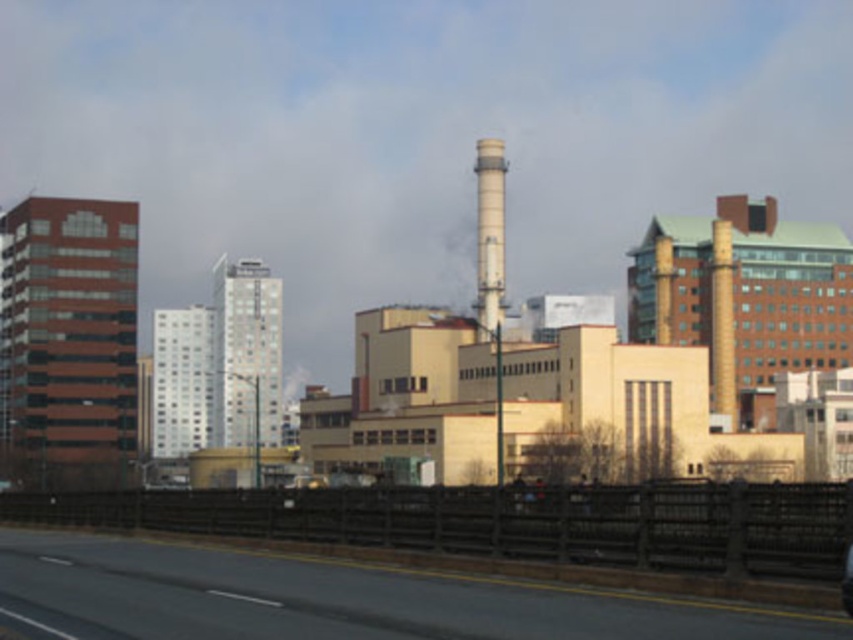
Can you confirm if black asphalt highway at lower center is positioned above shiny black car at center?

No, black asphalt highway at lower center is not above shiny black car at center.

From the picture: Which of these two, black asphalt highway at lower center or shiny black car at center, stands shorter?

Standing shorter between the two is shiny black car at center.

Which is in front, point (419, 637) or point (851, 576)?

Point (851, 576) is in front.

Image resolution: width=853 pixels, height=640 pixels. I want to click on black asphalt highway at lower center, so click(334, 600).

Which is below, white smooth chimney at center or shiny black car at center?

shiny black car at center is below.

Is white smooth chimney at center to the left of shiny black car at center from the viewer's perspective?

No, white smooth chimney at center is not to the left of shiny black car at center.

Is point (483, 168) positioned behind point (850, 513)?

Yes, it is behind point (850, 513).

Locate an element on the screen. white smooth chimney at center is located at coordinates (489, 232).

Does black asphalt highway at lower center have a greater height compared to white smooth chimney at center?

No.

Does black asphalt highway at lower center lie behind white smooth chimney at center?

No, it is in front of white smooth chimney at center.

Which is behind, point (170, 605) or point (479, 140)?

Positioned behind is point (479, 140).

At what (x,y) coordinates should I click in order to perform the action: click on black asphalt highway at lower center. Please return your answer as a coordinate pair (x, y). Looking at the image, I should click on (334, 600).